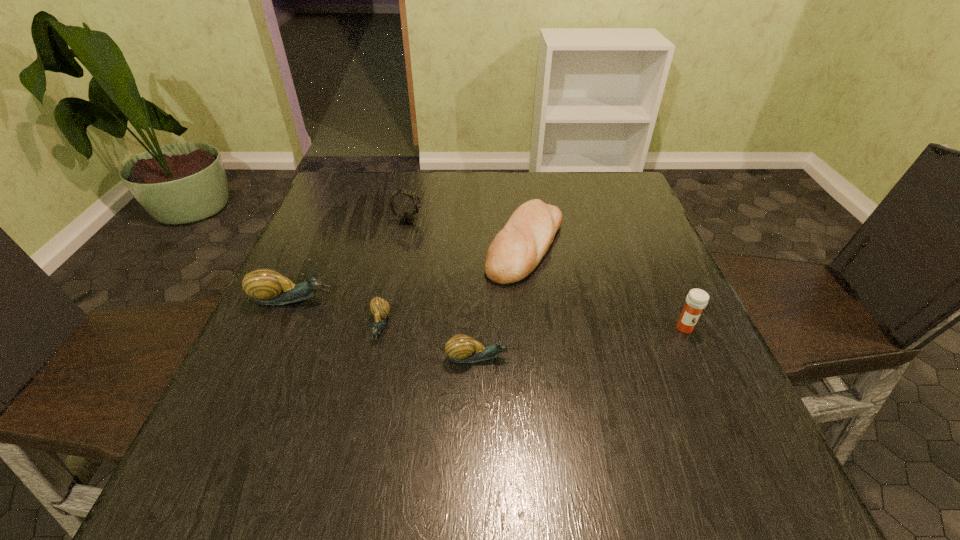
Where is `free spot located on the front-facing side of the shortest escargot`? The width and height of the screenshot is (960, 540). free spot located on the front-facing side of the shortest escargot is located at coordinates (369, 376).

Where is `free space located on the front-facing side of the nearest escargot`? The height and width of the screenshot is (540, 960). free space located on the front-facing side of the nearest escargot is located at coordinates (596, 357).

You are a GUI agent. You are given a task and a screenshot of the screen. Output one action in this format:
    pyautogui.click(x=<x>, y=<y>)
    Task: Click on the blank space located 0.260m on the face of the watch
    This screenshot has height=540, width=960.
    Given the screenshot: What is the action you would take?
    pyautogui.click(x=519, y=221)

The height and width of the screenshot is (540, 960). I want to click on free point located 0.380m on the left of the bread, so click(x=331, y=245).

Where is `vacant space situated 0.100m on the label side of the rightmost object`? The image size is (960, 540). vacant space situated 0.100m on the label side of the rightmost object is located at coordinates (708, 377).

At what (x,y) coordinates should I click in order to perform the action: click on watch that is at the far edge. Please return your answer as a coordinate pair (x, y). Looking at the image, I should click on (405, 218).

Find the location of `bread at the far edge`. bread at the far edge is located at coordinates (517, 249).

The width and height of the screenshot is (960, 540). What are the coordinates of `object at the left edge` in the screenshot? It's located at (268, 287).

The width and height of the screenshot is (960, 540). In order to click on object that is positioned at the right edge in this screenshot , I will do `click(697, 299)`.

Where is `vacant space at the far edge of the desktop`? This screenshot has width=960, height=540. vacant space at the far edge of the desktop is located at coordinates (454, 179).